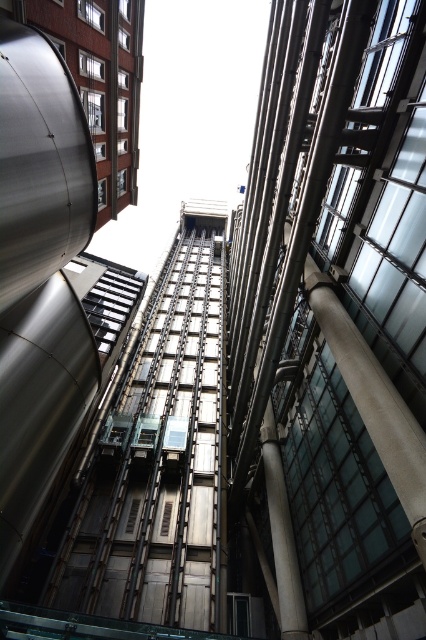
You are standing at the base of the atrium and want to take the elevator to the upper floors. Which object would you approach first, the metallic glass elevator at center or the white glossy column at center?

You would approach the metallic glass elevator at center first because it is positioned in front of the white glossy column at center, making it closer to your current position.

You are an architect reviewing this design. You need to determine the spatial relationship between the metallic elevator at center and the white glossy column at center. Based on the scene, which one is positioned higher?

The metallic elevator at center is positioned higher than the white glossy column at center.